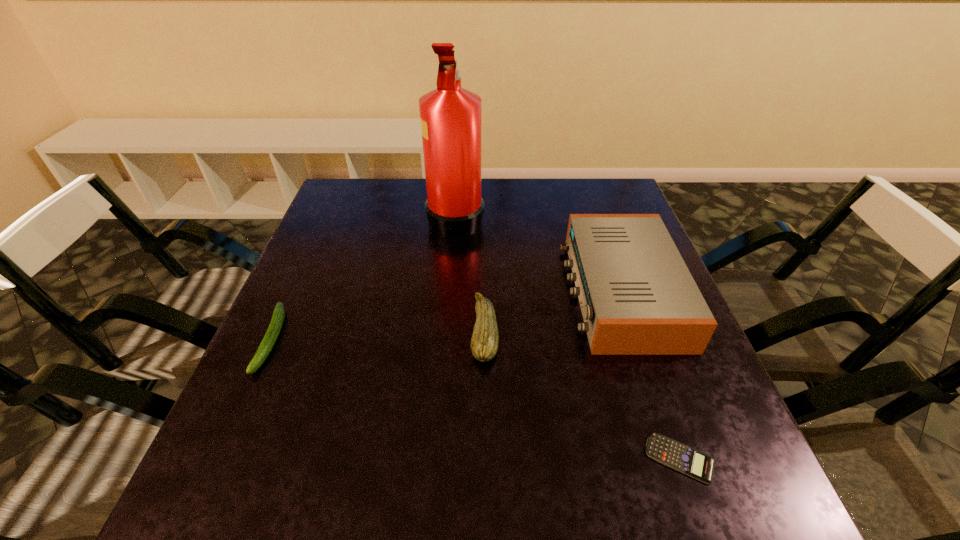
What are the coordinates of `free location that satisfies the following two spatial constraints: 1. at the stem end of the shortest object; 2. on the left side of the taller zucchini` in the screenshot? It's located at (486, 458).

The width and height of the screenshot is (960, 540). Identify the location of free space that satisfies the following two spatial constraints: 1. at the stem end of the third shortest object; 2. on the front-facing side of the shorter zucchini. (485, 340).

At what (x,y) coordinates should I click in order to perform the action: click on free spot that satisfies the following two spatial constraints: 1. at the stem end of the taller zucchini; 2. on the front-facing side of the left zucchini. Please return your answer as a coordinate pair (x, y). The image size is (960, 540). Looking at the image, I should click on (485, 340).

Where is `vacant region that satisfies the following two spatial constraints: 1. at the spray nozzle of the fire extinguisher; 2. on the front-facing side of the fourth tallest object`? vacant region that satisfies the following two spatial constraints: 1. at the spray nozzle of the fire extinguisher; 2. on the front-facing side of the fourth tallest object is located at coordinates (447, 340).

The image size is (960, 540). Find the location of `vacant space that satisfies the following two spatial constraints: 1. at the spray nozzle of the fire extinguisher; 2. on the front-facing side of the second shortest object`. vacant space that satisfies the following two spatial constraints: 1. at the spray nozzle of the fire extinguisher; 2. on the front-facing side of the second shortest object is located at coordinates (447, 340).

Find the location of a particular element. free space that satisfies the following two spatial constraints: 1. at the stem end of the taller zucchini; 2. on the front-facing side of the leftmost object is located at coordinates (485, 340).

Locate an element on the screen. The width and height of the screenshot is (960, 540). vacant point that satisfies the following two spatial constraints: 1. at the spray nozzle of the fire extinguisher; 2. on the right side of the calculator is located at coordinates pos(439,458).